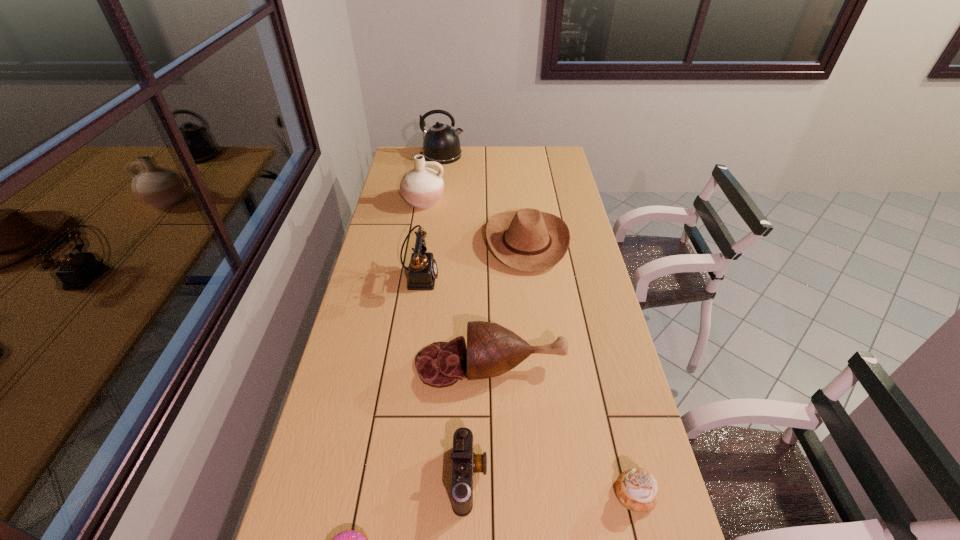
At what (x,y) coordinates should I click in order to perform the action: click on free location located at the sliced end of the fifth farthest object. Please return your answer as a coordinate pair (x, y). Image resolution: width=960 pixels, height=540 pixels. Looking at the image, I should click on (390, 364).

The width and height of the screenshot is (960, 540). Identify the location of vacant space located 0.050m at the sliced end of the fifth farthest object. (399, 364).

The height and width of the screenshot is (540, 960). I want to click on free spot located 0.090m at the sliced end of the fifth farthest object, so click(386, 364).

Where is `vacant area located on the front-facing side of the cowboy hat`? vacant area located on the front-facing side of the cowboy hat is located at coordinates (441, 242).

This screenshot has height=540, width=960. Find the location of `free space located 0.060m on the front-facing side of the cowboy hat`. free space located 0.060m on the front-facing side of the cowboy hat is located at coordinates (470, 242).

At what (x,y) coordinates should I click in order to perform the action: click on vacant position located 0.290m on the front-facing side of the cowboy hat. Please return your answer as a coordinate pair (x, y). Image resolution: width=960 pixels, height=540 pixels. Looking at the image, I should click on (414, 242).

Identify the location of vacant area situated 0.230m on the lens of the camera. (579, 477).

The width and height of the screenshot is (960, 540). I want to click on free space located on the back of the pastry, so click(609, 384).

Locate an element on the screen. Image resolution: width=960 pixels, height=540 pixels. object located in the far edge section of the desktop is located at coordinates (441, 143).

The image size is (960, 540). Find the location of `kettle that is at the left edge`. kettle that is at the left edge is located at coordinates (441, 143).